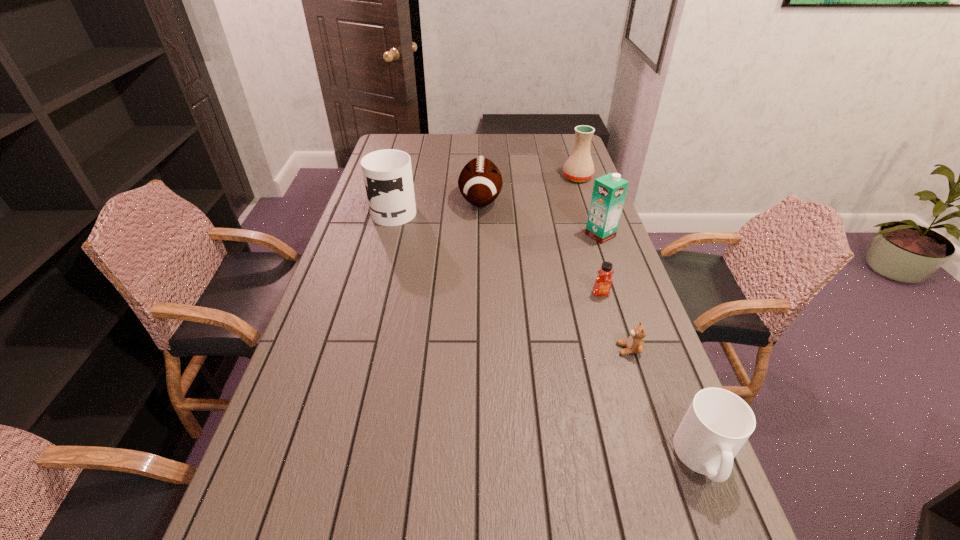
Image resolution: width=960 pixels, height=540 pixels. I want to click on the sixth farthest object, so click(635, 344).

This screenshot has width=960, height=540. Find the location of `the shortest object`. the shortest object is located at coordinates click(635, 344).

This screenshot has height=540, width=960. In order to click on vacant space located 0.090m on the handle side of the taller mug in this screenshot , I will do `click(402, 183)`.

At what (x,y) coordinates should I click in order to perform the action: click on vacant region located 0.330m on the handle side of the taller mug. Please return your answer as a coordinate pair (x, y). This screenshot has height=540, width=960. Looking at the image, I should click on (409, 156).

This screenshot has width=960, height=540. In order to click on vacant space located 0.120m on the handle side of the taller mug in this screenshot , I will do `click(403, 179)`.

Where is `vacant space situated 0.180m on the back of the pottery`? vacant space situated 0.180m on the back of the pottery is located at coordinates (568, 152).

The image size is (960, 540). Find the location of `vacant space located on the back of the carton`. vacant space located on the back of the carton is located at coordinates (580, 176).

I want to click on vacant area situated 0.210m on the back of the fourth tallest object, so click(480, 160).

Where is `vacant space located on the front label of the fifth farthest object`? The width and height of the screenshot is (960, 540). vacant space located on the front label of the fifth farthest object is located at coordinates (622, 362).

Identify the location of vacant region located 0.250m on the front-facing side of the shortest object. (521, 349).